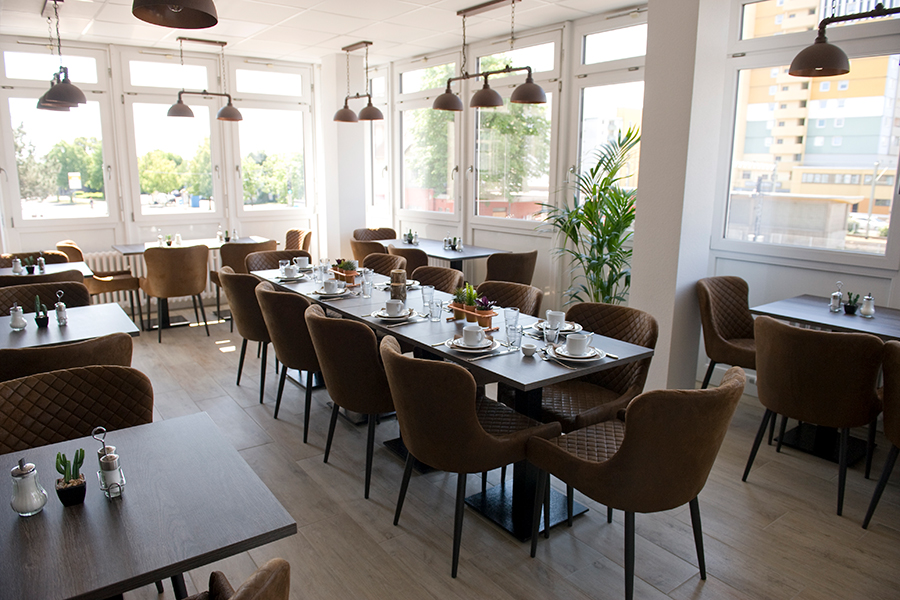
Identify the location of salt and pepper shakers. (109, 451), (58, 304), (39, 258), (833, 298), (445, 240).